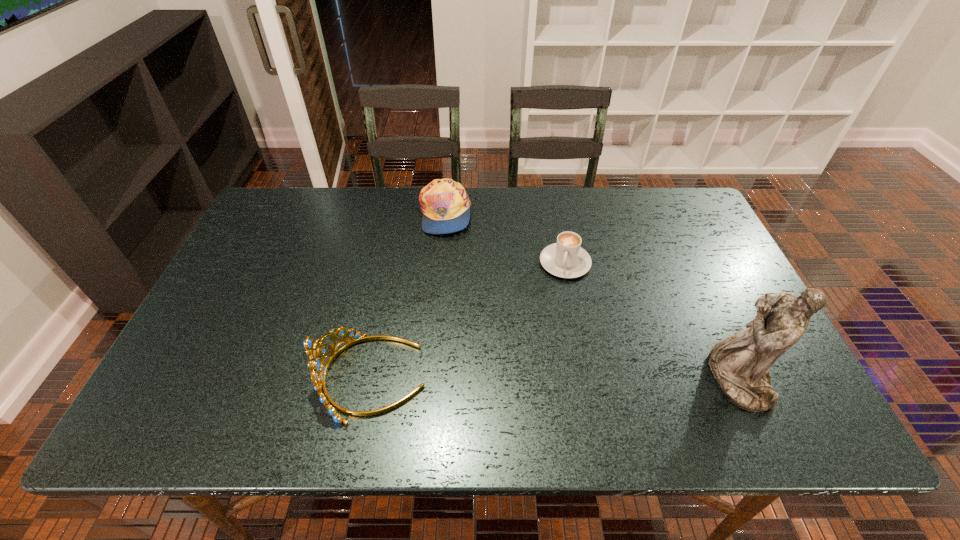
This screenshot has width=960, height=540. In order to click on the second tallest object in this screenshot , I will do `click(318, 370)`.

Identify the location of the tallest object. (740, 363).

The width and height of the screenshot is (960, 540). Find the location of `the rightmost object`. the rightmost object is located at coordinates (740, 363).

You are a GUI agent. You are given a task and a screenshot of the screen. Output one action in this format:
    pyautogui.click(x=<x>, y=<y>)
    Task: Click on the third nearest object
    
    Given the screenshot: What is the action you would take?
    pyautogui.click(x=566, y=259)

The image size is (960, 540). In order to click on the third object from left to right in this screenshot , I will do `click(566, 259)`.

Locate an element on the screen. the farthest object is located at coordinates (445, 204).

Where is `vacant position located on the front-facing side of the third shortest object`? Image resolution: width=960 pixels, height=540 pixels. vacant position located on the front-facing side of the third shortest object is located at coordinates (227, 377).

Image resolution: width=960 pixels, height=540 pixels. Find the location of `free space located on the front-facing side of the third shortest object`. free space located on the front-facing side of the third shortest object is located at coordinates (298, 377).

This screenshot has height=540, width=960. In order to click on free space located on the front-facing side of the third shortest object in this screenshot , I will do `click(200, 377)`.

The height and width of the screenshot is (540, 960). Find the location of `vacant space situated on the front-facing side of the tallest object`. vacant space situated on the front-facing side of the tallest object is located at coordinates (558, 379).